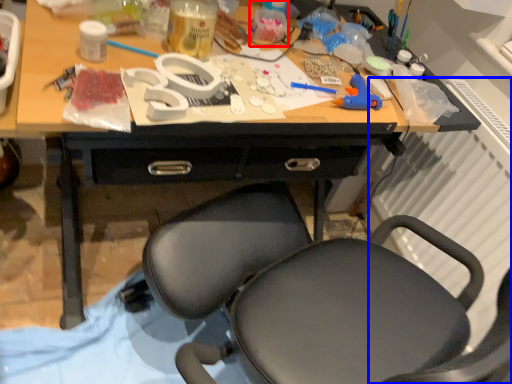
Question: Which object appears closest to the camera in this image, bottle (highlighted by a red box) or radiator (highlighted by a blue box)?

Choices:
 (A) bottle
 (B) radiator

Answer: (B)